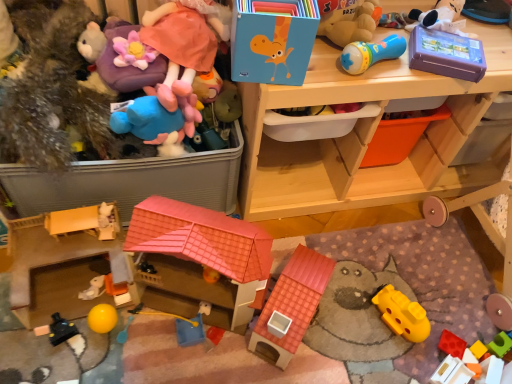
Where is `vacant space to the left of white plush toy at lower left, the third toy positioned from the left`? This screenshot has height=384, width=512. vacant space to the left of white plush toy at lower left, the third toy positioned from the left is located at coordinates (49, 297).